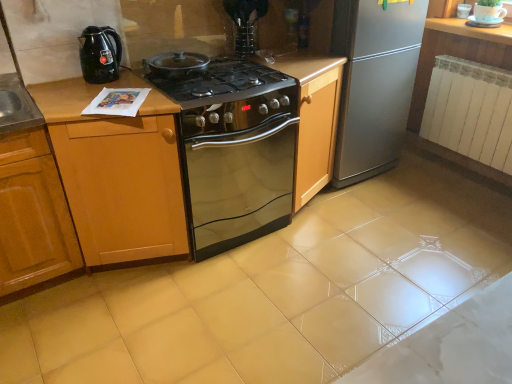
Question: Considering the relative sizes of clear glass vase at upper center, the 1th appliance when ordered from front to back, and black glass cooktop at center in the image provided, is clear glass vase at upper center, the 1th appliance when ordered from front to back, thinner than black glass cooktop at center?

Choices:
 (A) yes
 (B) no

Answer: (A)

Question: Is clear glass vase at upper center, positioned as the first appliance in bottom-to-top order, in front of black glass cooktop at center?

Choices:
 (A) no
 (B) yes

Answer: (A)

Question: Does clear glass vase at upper center, the 1th appliance when ordered from front to back, have a greater width compared to black glass cooktop at center?

Choices:
 (A) no
 (B) yes

Answer: (A)

Question: Is clear glass vase at upper center, the 1th appliance viewed from the left, bigger than black glass cooktop at center?

Choices:
 (A) yes
 (B) no

Answer: (B)

Question: Is black glass cooktop at center completely or partially inside clear glass vase at upper center, which is the 2th appliance from right to left?

Choices:
 (A) yes
 (B) no

Answer: (B)

Question: From the image's perspective, is clear glass vase at upper center, which is the 2th appliance from right to left, located above black glass cooktop at center?

Choices:
 (A) yes
 (B) no

Answer: (A)

Question: Is white metallic radiator at right turned away from clear glass vase at upper center, which is the 2th appliance from right to left?

Choices:
 (A) no
 (B) yes

Answer: (A)

Question: Does white metallic radiator at right have a greater width compared to clear glass vase at upper center, the 2th appliance in the top-to-bottom sequence?

Choices:
 (A) no
 (B) yes

Answer: (B)

Question: Does white metallic radiator at right lie in front of clear glass vase at upper center, the 2th appliance viewed from the back?

Choices:
 (A) yes
 (B) no

Answer: (B)

Question: From the image's perspective, would you say white metallic radiator at right is shown under clear glass vase at upper center, the 1th appliance when ordered from front to back?

Choices:
 (A) yes
 (B) no

Answer: (A)

Question: Considering the relative sizes of white metallic radiator at right and clear glass vase at upper center, the 1th appliance when ordered from front to back, in the image provided, is white metallic radiator at right taller than clear glass vase at upper center, the 1th appliance when ordered from front to back,?

Choices:
 (A) yes
 (B) no

Answer: (A)

Question: From a real-world perspective, does white metallic radiator at right stand above clear glass vase at upper center, positioned as the first appliance in bottom-to-top order?

Choices:
 (A) no
 (B) yes

Answer: (A)

Question: Does stainless steel oven at center contain white glossy cup at upper right, which appears as the second appliance when viewed from the front?

Choices:
 (A) no
 (B) yes

Answer: (A)